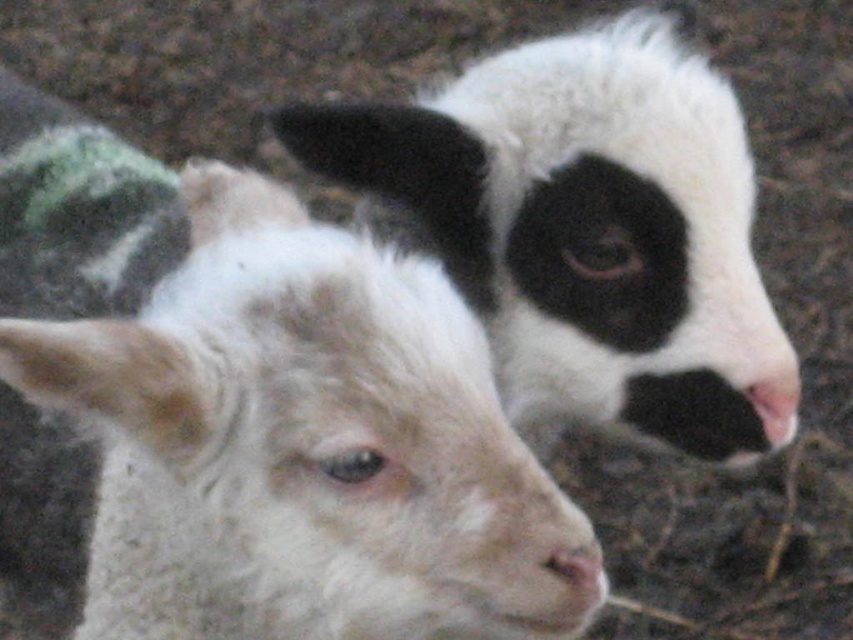
You are a photographer trying to capture the white woolen lamb at center and the white soft fur nose at center in your shot. Which one would appear larger in the photo?

The white woolen lamb at center would appear larger in the photo because it is closer to the viewer than the white soft fur nose at center.

You are a farmer checking the health of the lambs. You notice the white woolen lamb at center and the white soft fur nose at center. Which one is larger in size?

The white woolen lamb at center is bigger than the white soft fur nose at center.

In the scene shown: You are a farmer checking the barn. You notice the white woolen lamb at center and the white fluffy goat at upper right. Which animal is larger in size?

Answer: The white woolen lamb at center is bigger than the white fluffy goat at upper right.